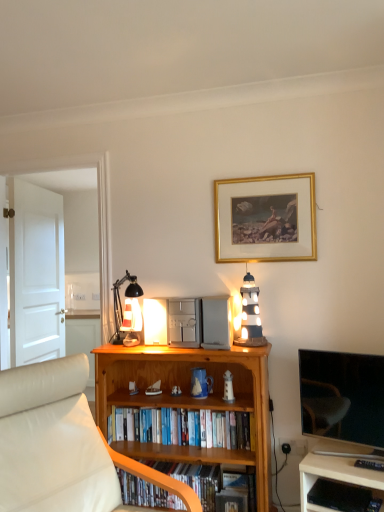
Question: In terms of height, does matte white glass table lamp at upper center look taller or shorter compared to wooden shelf at lower center, marked as the first book in a bottom-to-top arrangement?

Choices:
 (A) tall
 (B) short

Answer: (A)

Question: Is matte white glass table lamp at upper center bigger or smaller than wooden shelf at lower center, the 2th book in the top-to-bottom sequence?

Choices:
 (A) small
 (B) big

Answer: (A)

Question: Which object is positioned farthest from the matte white glass table lamp at upper center?

Choices:
 (A) white striped wood lighthouse at upper right
 (B) white painted wood door at left
 (C) gold/gilded picture frame at upper center
 (D) hardcover books at center, the second book from the bottom
 (E) flat screen tv at right

Answer: (E)

Question: Estimate the real-world distances between objects in this image. Which object is closer to the white striped wood lighthouse at upper right?

Choices:
 (A) matte white glass table lamp at upper center
 (B) wooden shelf at lower center, marked as the first book in a bottom-to-top arrangement
 (C) wooden bookcase at center
 (D) gold/gilded picture frame at upper center
 (E) flat screen tv at right

Answer: (D)